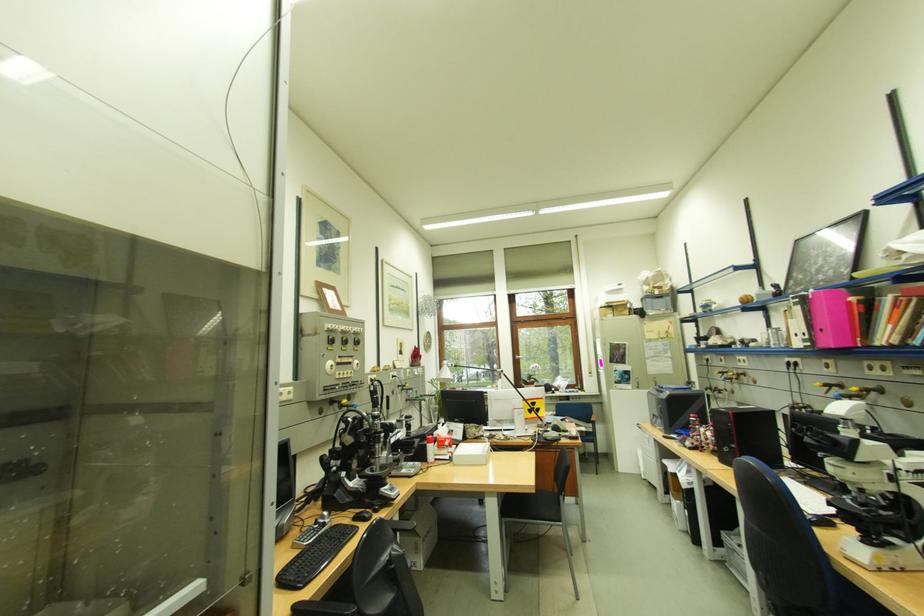
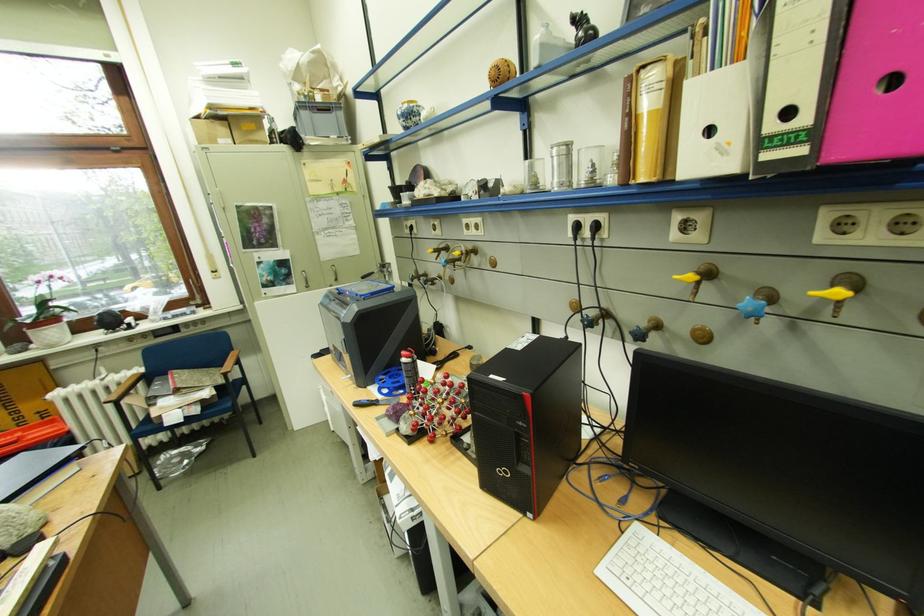
Find the pixel in the second image that matches the point at 830,386 in the first image.

(700, 277)